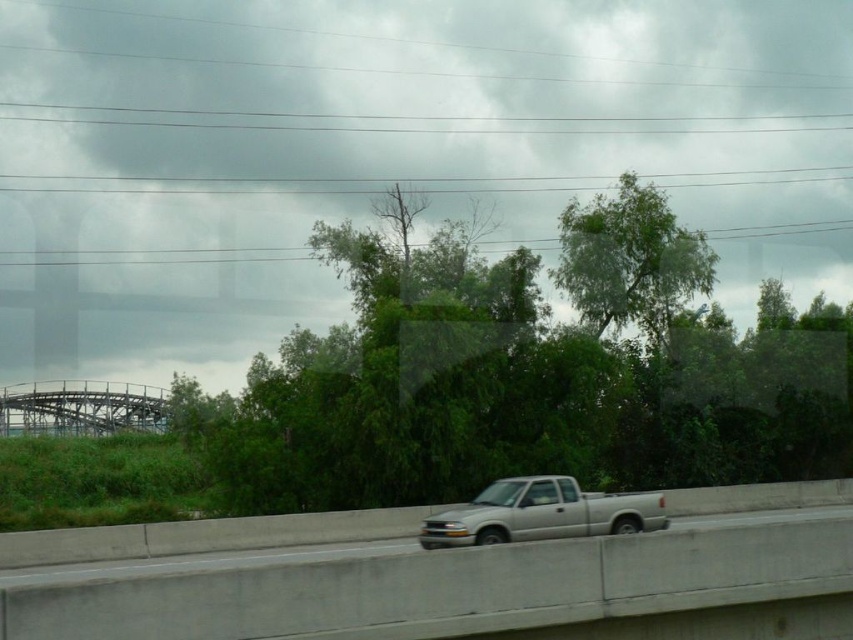
Question: Is silver metallic truck at center above metallic gray roller coaster at upper left?

Choices:
 (A) no
 (B) yes

Answer: (B)

Question: Which object appears farthest from the camera in this image?

Choices:
 (A) metallic gray roller coaster at upper left
 (B) silver metallic truck at center
 (C) green leafy tree at center

Answer: (A)

Question: Is silver metallic truck at center to the right of metallic gray roller coaster at upper left from the viewer's perspective?

Choices:
 (A) no
 (B) yes

Answer: (B)

Question: Is green leafy tree at center closer to camera compared to silver metallic truck at center?

Choices:
 (A) yes
 (B) no

Answer: (B)

Question: Which of the following is the farthest from the observer?

Choices:
 (A) metallic gray roller coaster at upper left
 (B) green leafy tree at center
 (C) green leafy tree at upper center

Answer: (A)

Question: Which object is positioned farthest from the silver metallic truck at center?

Choices:
 (A) green leafy tree at center
 (B) metallic gray roller coaster at upper left
 (C) green leafy tree at upper center

Answer: (B)